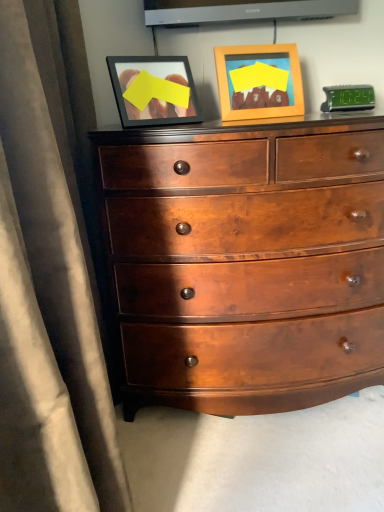
Question: Is wooden picture frame at upper center surrounding glossy wood chest of drawers at center?

Choices:
 (A) yes
 (B) no

Answer: (B)

Question: From a real-world perspective, is wooden picture frame at upper center physically below glossy wood chest of drawers at center?

Choices:
 (A) yes
 (B) no

Answer: (B)

Question: Does wooden picture frame at upper center have a lesser height compared to glossy wood chest of drawers at center?

Choices:
 (A) no
 (B) yes

Answer: (B)

Question: Is wooden picture frame at upper center turned away from glossy wood chest of drawers at center?

Choices:
 (A) no
 (B) yes

Answer: (A)

Question: Does wooden picture frame at upper center have a lesser width compared to glossy wood chest of drawers at center?

Choices:
 (A) yes
 (B) no

Answer: (A)

Question: Considering the relative positions of wooden picture frame at upper center and glossy wood chest of drawers at center in the image provided, is wooden picture frame at upper center behind glossy wood chest of drawers at center?

Choices:
 (A) no
 (B) yes

Answer: (B)

Question: Considering the relative positions of glossy wood chest of drawers at center and wooden picture frame at upper center in the image provided, is glossy wood chest of drawers at center to the left of wooden picture frame at upper center from the viewer's perspective?

Choices:
 (A) yes
 (B) no

Answer: (A)

Question: Is glossy wood chest of drawers at center oriented away from wooden picture frame at upper center?

Choices:
 (A) yes
 (B) no

Answer: (B)

Question: Is glossy wood chest of drawers at center surrounding wooden picture frame at upper center?

Choices:
 (A) yes
 (B) no

Answer: (B)

Question: From a real-world perspective, is glossy wood chest of drawers at center on top of wooden picture frame at upper center?

Choices:
 (A) no
 (B) yes

Answer: (A)

Question: Is glossy wood chest of drawers at center in contact with wooden picture frame at upper center?

Choices:
 (A) yes
 (B) no

Answer: (B)

Question: Can you confirm if glossy wood chest of drawers at center is thinner than wooden picture frame at upper center?

Choices:
 (A) yes
 (B) no

Answer: (B)

Question: Is wooden picture frame at upper center taller or shorter than glossy wood chest of drawers at center?

Choices:
 (A) short
 (B) tall

Answer: (A)